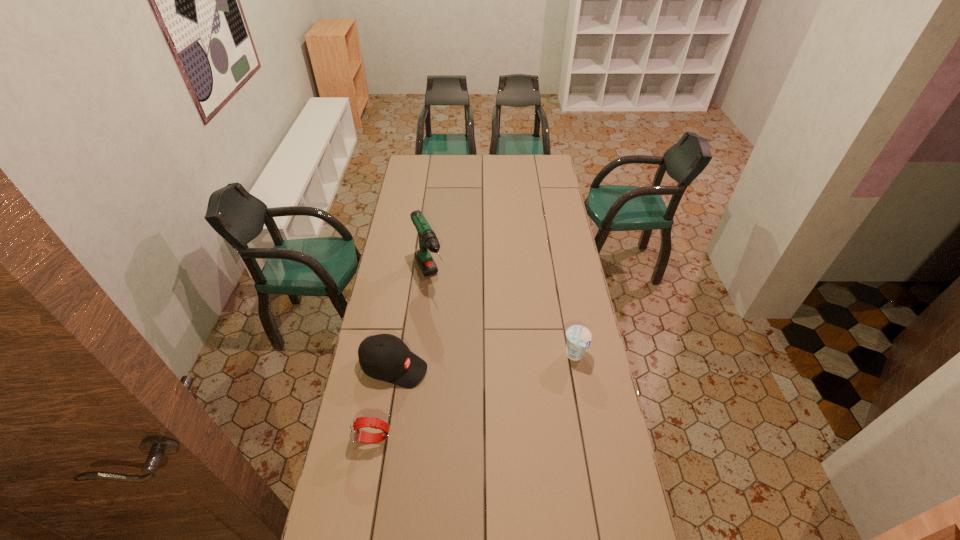
Locate an element on the screen. The height and width of the screenshot is (540, 960). vacant space on the desktop that is between the watch and the yogurt and is positioned with a logo on the front of the baseball cap is located at coordinates (480, 395).

Identify the location of vacant space on the desktop that is between the watch and the yogurt and is positioned on the handle side of the farthest object. (489, 391).